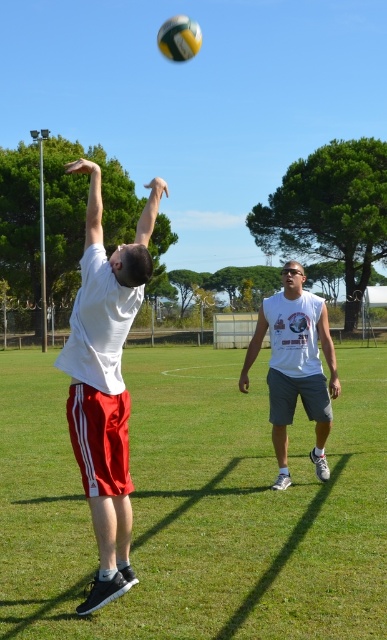
Question: Does white matte shirt at left appear over white sleeveless shirt at center?

Choices:
 (A) yes
 (B) no

Answer: (A)

Question: Considering the relative positions of white sleeveless shirt at center and yellow matte volleyball at upper center in the image provided, where is white sleeveless shirt at center located with respect to yellow matte volleyball at upper center?

Choices:
 (A) above
 (B) below

Answer: (B)

Question: Is white fabric shorts at center smaller than yellow matte volleyball at upper center?

Choices:
 (A) yes
 (B) no

Answer: (B)

Question: Considering the real-world distances, which object is closest to the white sleeveless shirt at center?

Choices:
 (A) white matte shirt at left
 (B) white fabric shorts at center
 (C) yellow matte volleyball at upper center

Answer: (A)

Question: Which of these objects is positioned farthest from the white matte shirt at left?

Choices:
 (A) white sleeveless shirt at center
 (B) yellow matte volleyball at upper center

Answer: (B)

Question: Which point appears closest to the camera in this image?

Choices:
 (A) (179, 42)
 (B) (285, 369)

Answer: (B)